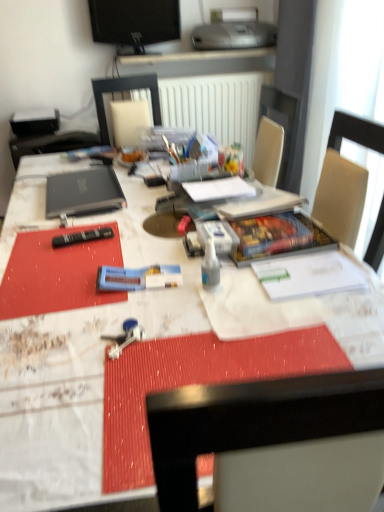
The height and width of the screenshot is (512, 384). Describe the element at coordinates (234, 30) in the screenshot. I see `silver metallic printer at upper center` at that location.

Find the location of `transparent plastic bottle at center`. transparent plastic bottle at center is located at coordinates (210, 266).

What do you see at coordinates (81, 371) in the screenshot? The width and height of the screenshot is (384, 512). I see `white glossy desk at center` at bounding box center [81, 371].

Identify the location of white paper at center. (218, 189).

Where is `black matte laptop at left`? black matte laptop at left is located at coordinates (83, 192).

I want to click on silver metallic printer at upper center, so click(234, 30).

Considering the positions of objects silver metallic printer at upper center and black glossy monitor at upper center in the image provided, who is more to the left, silver metallic printer at upper center or black glossy monitor at upper center?

Positioned to the left is black glossy monitor at upper center.

Between silver metallic printer at upper center and black glossy monitor at upper center, which one has smaller width?

Thinner between the two is black glossy monitor at upper center.

Which object is further away from the camera taking this photo, silver metallic printer at upper center or black glossy monitor at upper center?

silver metallic printer at upper center is further away from the camera.

Would you say silver metallic printer at upper center is outside black glossy monitor at upper center?

Absolutely, silver metallic printer at upper center is external to black glossy monitor at upper center.

In the scene shown: Is the position of blue plastic toothpaste tube at center more distant than that of black glossy monitor at upper center?

No.

Between point (169, 283) and point (174, 22), which one is positioned behind?

Positioned behind is point (174, 22).

Considering the relative sizes of blue plastic toothpaste tube at center and black glossy monitor at upper center in the image provided, is blue plastic toothpaste tube at center smaller than black glossy monitor at upper center?

Correct, blue plastic toothpaste tube at center occupies less space than black glossy monitor at upper center.

Which is more to the right, black glossy monitor at upper center or white paper at center?

white paper at center is more to the right.

Can you confirm if black glossy monitor at upper center is wider than white paper at center?

Incorrect, the width of black glossy monitor at upper center does not surpass that of white paper at center.

Is black glossy monitor at upper center positioned far away from white paper at center?

Yes, black glossy monitor at upper center is far from white paper at center.

Can you tell me how much black glossy monitor at upper center and white paper at center differ in facing direction?

The angular difference between black glossy monitor at upper center and white paper at center is 71 degrees.

In order to click on bottle lying in front of the black matte laptop at left in this screenshot , I will do `click(210, 266)`.

Considering the points (105, 197) and (211, 287), which point is behind, point (105, 197) or point (211, 287)?

Positioned behind is point (105, 197).

In terms of width, does black matte laptop at left look wider or thinner when compared to transparent plastic bottle at center?

black matte laptop at left is wider than transparent plastic bottle at center.

Does black matte laptop at left have a lesser height compared to transparent plastic bottle at center?

Yes, black matte laptop at left is shorter than transparent plastic bottle at center.

Does point (106, 182) come in front of point (251, 30)?

Yes, point (106, 182) is closer to viewer.

Is black matte laptop at left bigger or smaller than silver metallic printer at upper center?

Clearly, black matte laptop at left is smaller in size than silver metallic printer at upper center.

Is silver metallic printer at upper center a part of black matte laptop at left?

No, black matte laptop at left does not contain silver metallic printer at upper center.

At what (x,y) coordinates should I click in order to perform the action: click on laptop in front of the silver metallic printer at upper center. Please return your answer as a coordinate pair (x, y). This screenshot has width=384, height=512. Looking at the image, I should click on (83, 192).

Is blue plastic toothpaste tube at center taller than black matte laptop at left?

No.

Which of these two, blue plastic toothpaste tube at center or black matte laptop at left, is thinner?

With smaller width is blue plastic toothpaste tube at center.

From the image's perspective, would you say blue plastic toothpaste tube at center is positioned over black matte laptop at left?

Actually, blue plastic toothpaste tube at center appears below black matte laptop at left in the image.

I want to click on equipment below the black matte laptop at left (from a real-world perspective), so click(x=138, y=278).

From the image's perspective, is white paper at center positioned above or below white glossy desk at center?

Clearly, from the image's perspective, white paper at center is above white glossy desk at center.

Is white paper at center oriented towards white glossy desk at center?

No, white paper at center is not oriented towards white glossy desk at center.

From the picture: Can you confirm if white paper at center is taller than white glossy desk at center?

No, white paper at center is not taller than white glossy desk at center.

Considering the sizes of objects white paper at center and white glossy desk at center in the image provided, who is wider, white paper at center or white glossy desk at center?

white glossy desk at center.

The height and width of the screenshot is (512, 384). What are the coordinates of `television that appears on the left of silver metallic printer at upper center` in the screenshot? It's located at (134, 23).

Where is `equipment on the right of the black glossy monitor at upper center`? The image size is (384, 512). equipment on the right of the black glossy monitor at upper center is located at coordinates point(138,278).

Considering their positions, is white paper at center positioned closer to silver metallic printer at upper center than blue plastic toothpaste tube at center?

Among the two, white paper at center is located nearer to silver metallic printer at upper center.

From the image, which object appears to be nearer to black glossy monitor at upper center, transparent plastic bottle at center or black matte laptop at left?

Based on the image, black matte laptop at left appears to be nearer to black glossy monitor at upper center.

Which object lies further to the anchor point silver metallic printer at upper center, black glossy monitor at upper center or white paper at center?

white paper at center.

Estimate the real-world distances between objects in this image. Which object is further from blue plastic toothpaste tube at center, black matte laptop at left or white paper at center?

Based on the image, black matte laptop at left appears to be further to blue plastic toothpaste tube at center.

Considering their positions, is white paper at center positioned closer to black matte laptop at left than white glossy desk at center?

Among the two, white glossy desk at center is located nearer to black matte laptop at left.

Which object lies nearer to the anchor point black matte laptop at left, blue plastic toothpaste tube at center or black glossy monitor at upper center?

blue plastic toothpaste tube at center.

Looking at the image, which one is located closer to white paper at center, black matte laptop at left or silver metallic printer at upper center?

→ Based on the image, black matte laptop at left appears to be nearer to white paper at center.

Considering their positions, is black glossy monitor at upper center positioned closer to white glossy desk at center than transparent plastic bottle at center?

Based on the image, transparent plastic bottle at center appears to be nearer to white glossy desk at center.

Identify the location of notebook between white glossy desk at center and black matte laptop at left in the front-back direction. (218, 189).

Where is `television between transparent plastic bottle at center and silver metallic printer at upper center along the z-axis`? television between transparent plastic bottle at center and silver metallic printer at upper center along the z-axis is located at coordinates (134, 23).

Identify the location of bottle positioned between white glossy desk at center and silver metallic printer at upper center from near to far. (210, 266).

Find the location of a particular element. The height and width of the screenshot is (512, 384). notebook between white glossy desk at center and silver metallic printer at upper center from front to back is located at coordinates (218, 189).